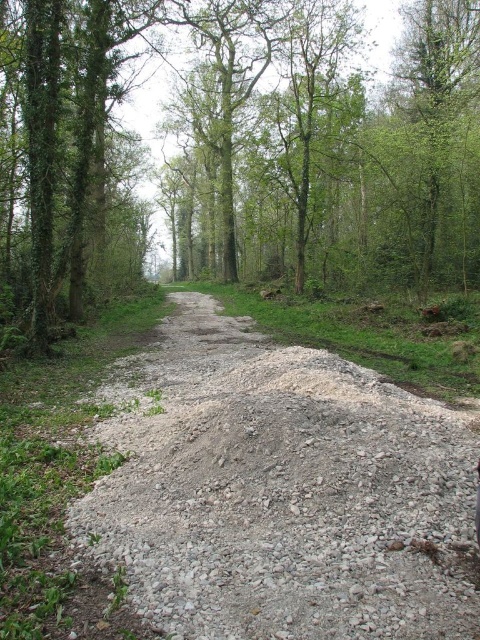
You are a hiker standing on the gray gravel dirt track at center and want to take a photo of the green leafy tree at center. Since your camera has a limited zoom, you need to know if you can capture the entire tree in one shot without moving closer. Can you do this based on their relative heights?

The green leafy tree at center is taller than the gray gravel dirt track at center. However, since the track is at ground level and the tree extends upward, you can likely capture the entire tree in one shot as long as you position yourself appropriately on the track.